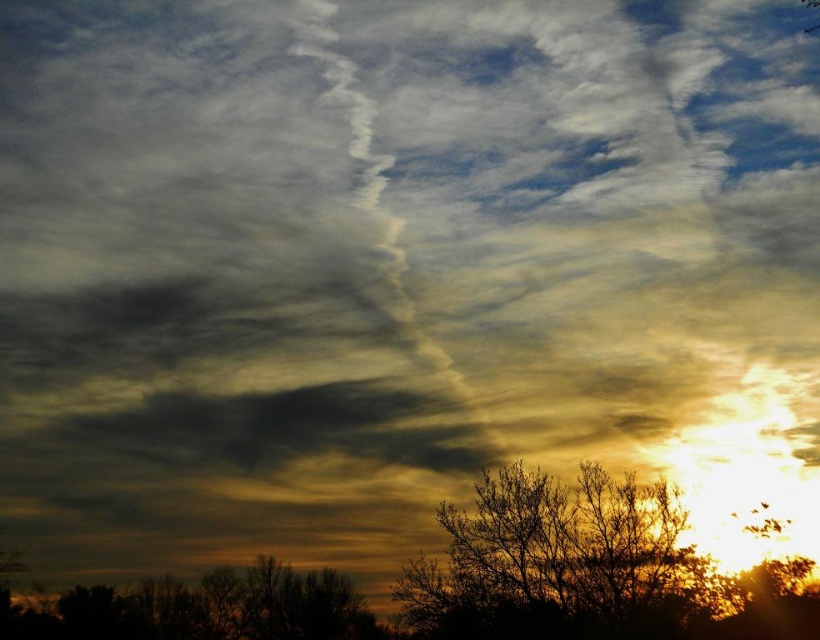
Question: Is silhouette bark tree at lower right bigger than brown matte tree at lower left?

Choices:
 (A) no
 (B) yes

Answer: (A)

Question: Does silhouette bark tree at lower right have a lesser width compared to brown matte tree at lower left?

Choices:
 (A) yes
 (B) no

Answer: (A)

Question: Which point is farther to the camera?

Choices:
 (A) (246, 568)
 (B) (672, 509)

Answer: (A)

Question: Does silhouette bark tree at lower right have a larger size compared to brown matte tree at lower left?

Choices:
 (A) yes
 (B) no

Answer: (B)

Question: Which point is farther from the camera taking this photo?

Choices:
 (A) (415, 563)
 (B) (330, 572)

Answer: (B)

Question: Which object is closer to the camera taking this photo?

Choices:
 (A) silhouette bark tree at lower right
 (B) brown matte tree at lower left

Answer: (A)